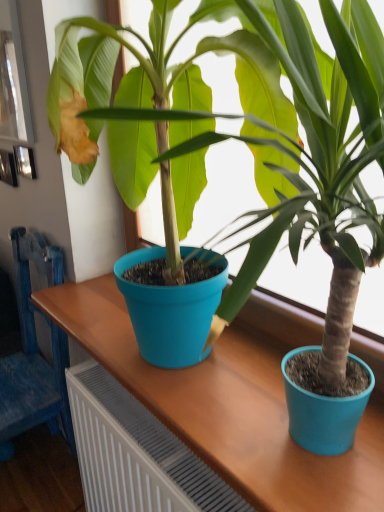
The height and width of the screenshot is (512, 384). Describe the element at coordinates (34, 352) in the screenshot. I see `blue fabric chair at left` at that location.

What is the approximate height of blue fabric chair at left?

The height of blue fabric chair at left is 1.00 meters.

You are a GUI agent. You are given a task and a screenshot of the screen. Output one action in this format:
    pyautogui.click(x=<x>, y=<y>)
    Task: Click on the blue fabric chair at left
    The image size is (384, 512).
    Given the screenshot: What is the action you would take?
    pyautogui.click(x=34, y=352)

Find the location of a particular element. The height and width of the screenshot is (512, 384). blue fabric chair at left is located at coordinates (34, 352).